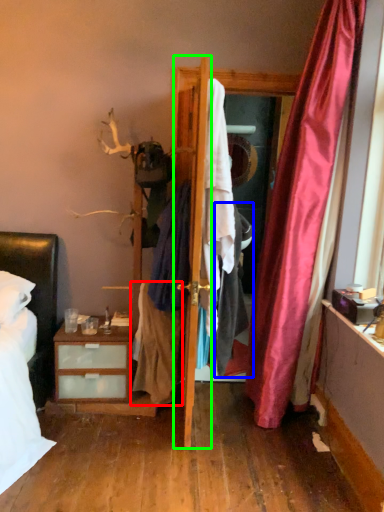
Question: Which object is the farthest from clothing (highlighted by a red box)? Choose among these: clothing (highlighted by a blue box) or door (highlighted by a green box).

Choices:
 (A) clothing
 (B) door

Answer: (B)